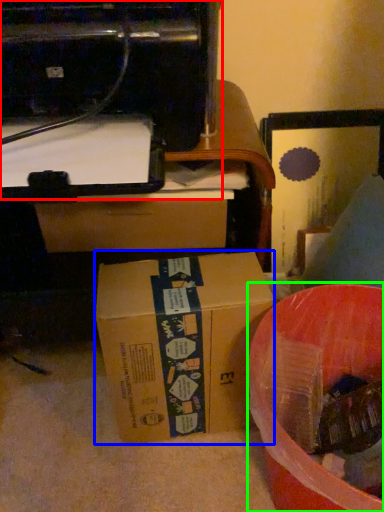
Question: Considering the real-world distances, which object is farthest from printer (highlighted by a red box)? box (highlighted by a blue box) or waste (highlighted by a green box)?

Choices:
 (A) box
 (B) waste

Answer: (B)